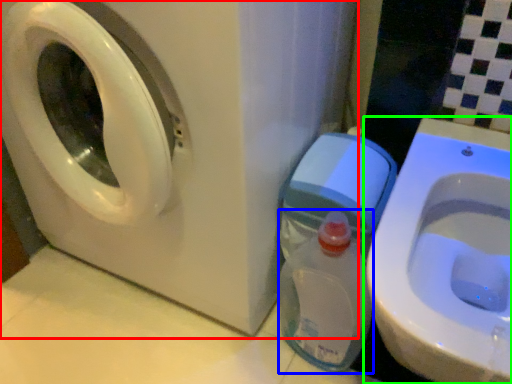
Question: Based on their relative distances, which object is farther from washing machine (highlighted by a red box)? Choose from baby bottle (highlighted by a blue box) and toilet (highlighted by a green box).

Choices:
 (A) baby bottle
 (B) toilet

Answer: (B)